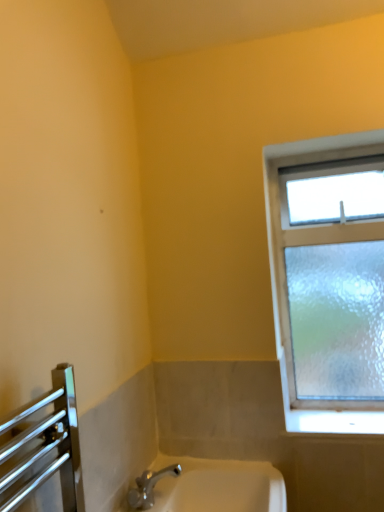
Question: Is frosted glass window at upper right to the left or to the right of white ceramic sink at lower center in the image?

Choices:
 (A) right
 (B) left

Answer: (A)

Question: Is point (266, 154) positioned closer to the camera than point (190, 490)?

Choices:
 (A) closer
 (B) farther

Answer: (B)

Question: From a real-world perspective, is frosted glass window at upper right above or below white ceramic sink at lower center?

Choices:
 (A) below
 (B) above

Answer: (B)

Question: Is point (180, 489) closer or farther from the camera than point (289, 200)?

Choices:
 (A) farther
 (B) closer

Answer: (B)

Question: Considering the positions of white ceramic sink at lower center and frosted glass window at upper right in the image, is white ceramic sink at lower center taller or shorter than frosted glass window at upper right?

Choices:
 (A) tall
 (B) short

Answer: (B)

Question: From a real-world perspective, is white ceramic sink at lower center positioned above or below frosted glass window at upper right?

Choices:
 (A) below
 (B) above

Answer: (A)

Question: Choose the correct answer: Is white ceramic sink at lower center inside frosted glass window at upper right or outside it?

Choices:
 (A) inside
 (B) outside

Answer: (B)